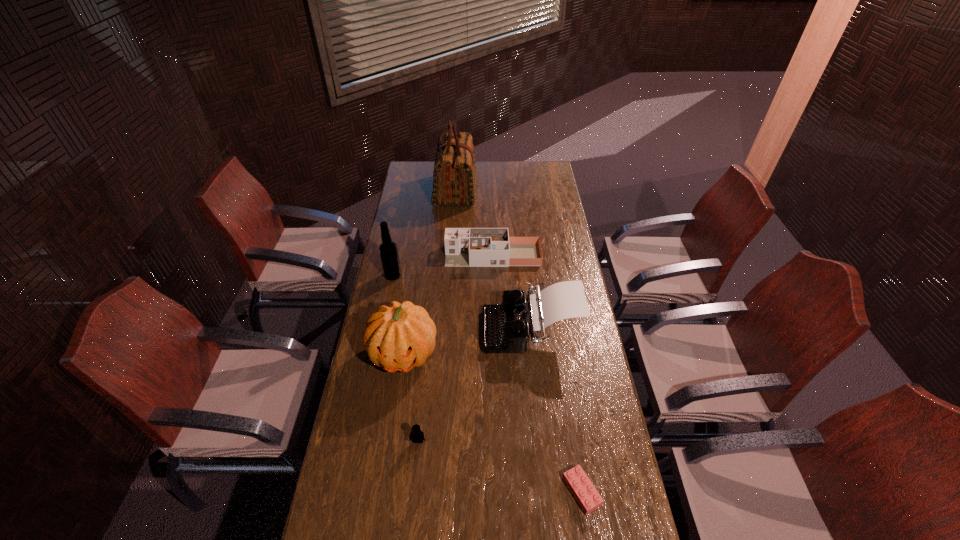
I want to click on object that stands as the closest to the beer bottle, so click(x=464, y=247).

Identify the location of object that is the fourth closest to the dollhouse. Image resolution: width=960 pixels, height=540 pixels. (399, 337).

Where is `vacant space that satisfies the following two spatial constraints: 1. on the keys of the typewriter; 2. on the carved face of the pumpkin`? Image resolution: width=960 pixels, height=540 pixels. vacant space that satisfies the following two spatial constraints: 1. on the keys of the typewriter; 2. on the carved face of the pumpkin is located at coordinates (533, 354).

Locate an element on the screen. Image resolution: width=960 pixels, height=540 pixels. blank space that satisfies the following two spatial constraints: 1. on the front-facing side of the shortest object; 2. on the right side of the sixth tallest object is located at coordinates (413, 491).

This screenshot has height=540, width=960. I want to click on vacant region that satisfies the following two spatial constraints: 1. at the front door of the dollhouse; 2. on the right side of the right Lego, so pos(500,491).